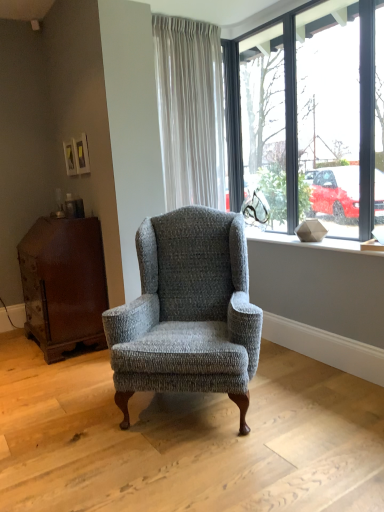
Find the location of a particular element. free space in front of textured gray wingback chair at center is located at coordinates (195, 467).